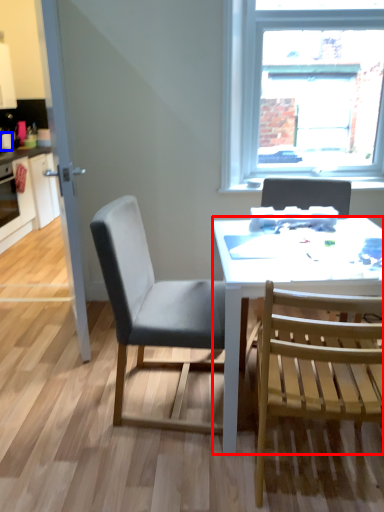
Question: Which of the following is the closest to the observer, desk (highlighted by a red box) or coffee cup (highlighted by a blue box)?

Choices:
 (A) desk
 (B) coffee cup

Answer: (A)